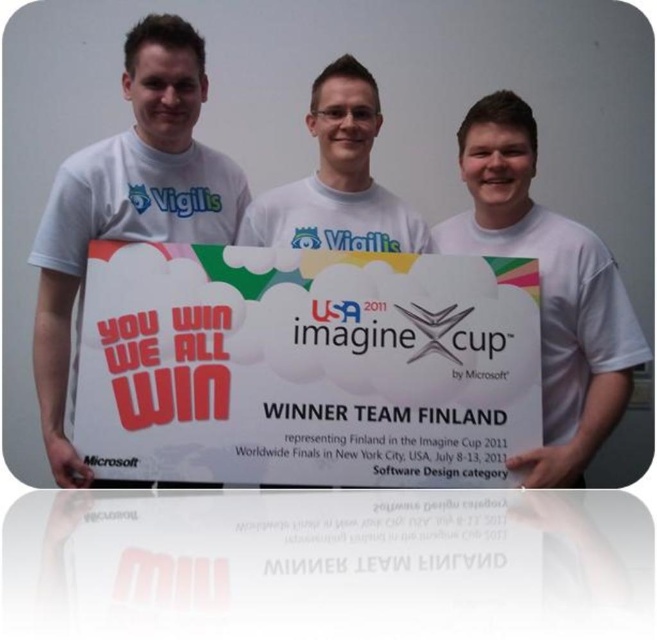
You are a photographer trying to capture the winning team from the Imagine Cup 2011. You notice two points on the sign. Which point, point at (x=583, y=301) or point at (x=350, y=211), is closer to you?

Point at (x=583, y=301) is closer to the viewer than point at (x=350, y=211).